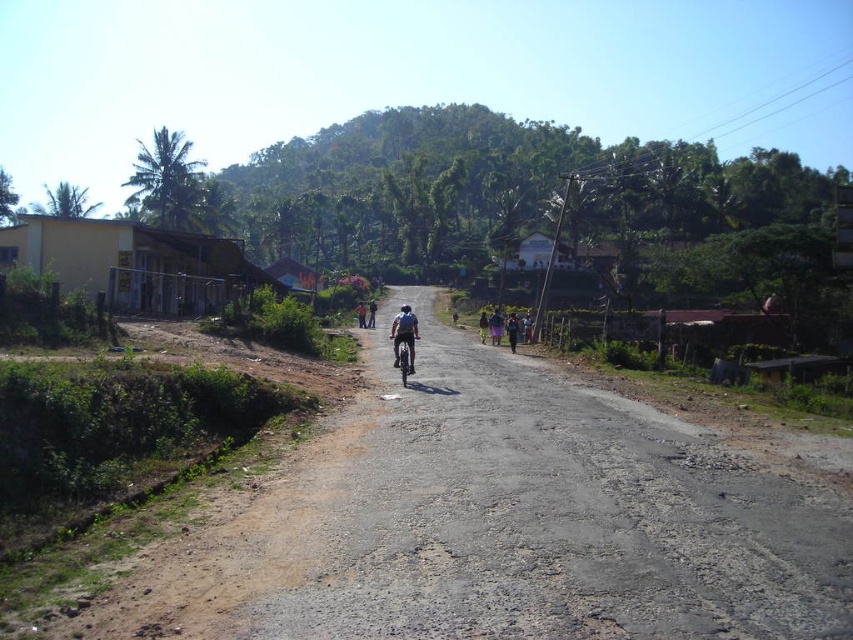
Question: Is blue fabric dress at center to the left of dark blue jeans at center from the viewer's perspective?

Choices:
 (A) yes
 (B) no

Answer: (B)

Question: Can you confirm if shiny metallic dirt bike at center is positioned to the right of blue fabric dress at center?

Choices:
 (A) no
 (B) yes

Answer: (A)

Question: Does brown dirt track at center have a greater width compared to dark blue jeans at center?

Choices:
 (A) yes
 (B) no

Answer: (A)

Question: Which point is closer to the camera?

Choices:
 (A) (216, 276)
 (B) (361, 301)

Answer: (A)

Question: Which object is positioned farthest from the brown dirt track at center?

Choices:
 (A) blue fabric dress at center
 (B) yellow matte building at left
 (C) shiny metallic dirt bike at center

Answer: (B)

Question: Which of the following is the farthest from the observer?

Choices:
 (A) (403, 381)
 (B) (360, 301)
 (C) (514, 324)
 (D) (448, 444)

Answer: (B)